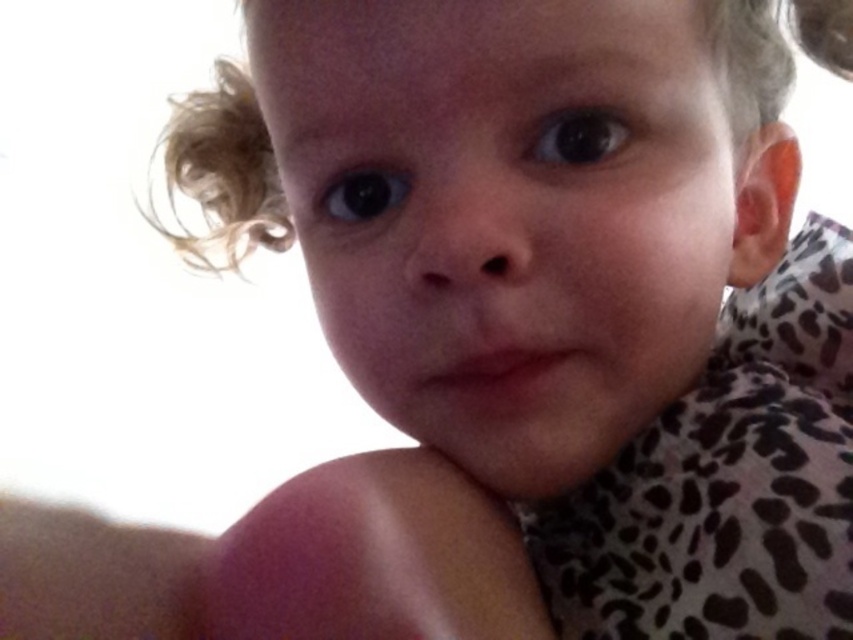
Is brown matte eye at center to the left of black glossy eye at upper left from the viewer's perspective?

In fact, brown matte eye at center is to the right of black glossy eye at upper left.

Does point (548, 150) come behind point (387, 198)?

No, it is in front of (387, 198).

Locate an element on the screen. The image size is (853, 640). brown matte eye at center is located at coordinates (579, 136).

Is curly blonde hair at upper left to the left of brown matte eye at center from the viewer's perspective?

Yes, curly blonde hair at upper left is to the left of brown matte eye at center.

Between point (224, 173) and point (572, 122), which one is positioned behind?

Positioned behind is point (224, 173).

This screenshot has height=640, width=853. Identify the location of curly blonde hair at upper left. (223, 173).

Is point (851, 10) farther from viewer compared to point (325, 202)?

Yes, it is.

Is curly blonde hair at upper left positioned before black glossy eye at upper left?

Yes, it is.

Is point (212, 125) farther from camera compared to point (368, 193)?

Yes.

Where is `curly blonde hair at upper left`? curly blonde hair at upper left is located at coordinates (223, 173).